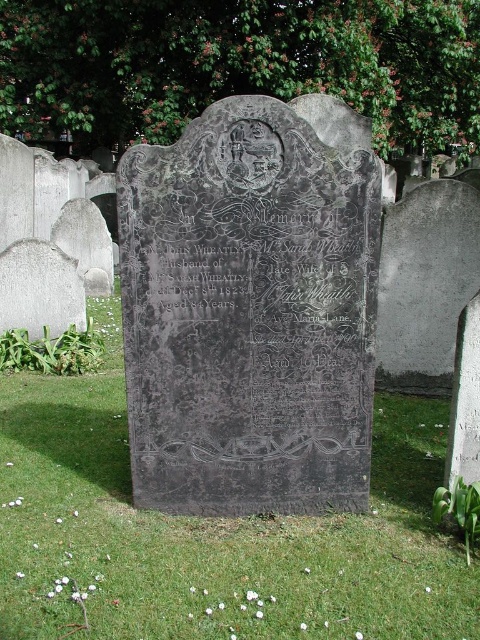
You are standing in a cemetery and see the black stone gravestone at center and the green grass at center. Which object is taller?

The black stone gravestone at center is taller than the green grass at center.